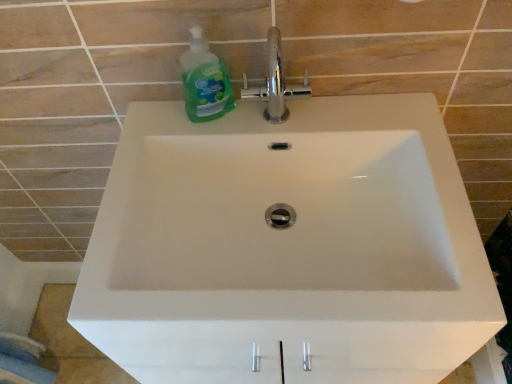
Question: Visually, is green translucent liquid soap at upper left positioned to the left or to the right of chrome metallic faucet at upper center?

Choices:
 (A) right
 (B) left

Answer: (B)

Question: Choose the correct answer: Is green translucent liquid soap at upper left inside chrome metallic faucet at upper center or outside it?

Choices:
 (A) outside
 (B) inside

Answer: (A)

Question: Is point (208, 64) positioned closer to the camera than point (287, 96)?

Choices:
 (A) farther
 (B) closer

Answer: (B)

Question: From a real-world perspective, relative to green translucent liquid soap at upper left, is chrome metallic faucet at upper center vertically above or below?

Choices:
 (A) below
 (B) above

Answer: (B)

Question: In terms of width, does chrome metallic faucet at upper center look wider or thinner when compared to green translucent liquid soap at upper left?

Choices:
 (A) wide
 (B) thin

Answer: (B)

Question: Is chrome metallic faucet at upper center inside or outside of green translucent liquid soap at upper left?

Choices:
 (A) outside
 (B) inside

Answer: (A)

Question: From the image's perspective, is chrome metallic faucet at upper center positioned above or below green translucent liquid soap at upper left?

Choices:
 (A) above
 (B) below

Answer: (A)